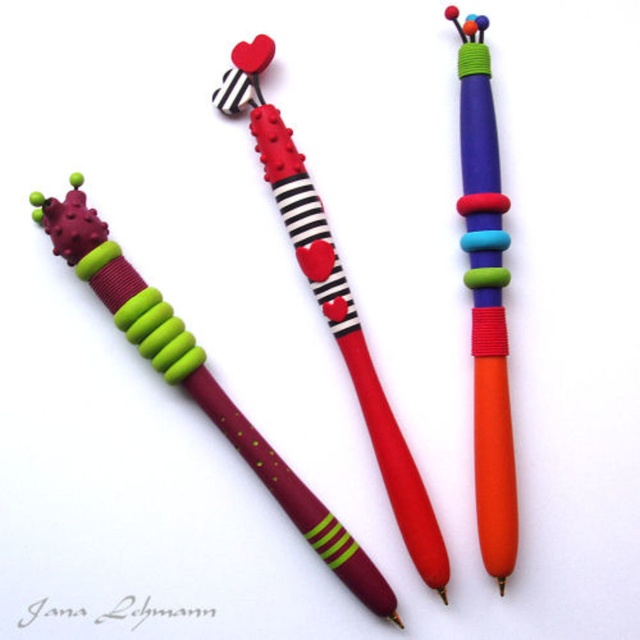
Which pen does the point at coordinates (198, 381) belong to?

The point at coordinates (198, 381) belongs to the burgundy matte pen at center.

You are organizing a stationery display and need to place the burgundy matte pen at center and the matte plastic pen at center in a vertical arrangement. According to the image, which pen should be placed higher up?

The matte plastic pen at center should be placed higher up because the burgundy matte pen at center is located below it in the image.